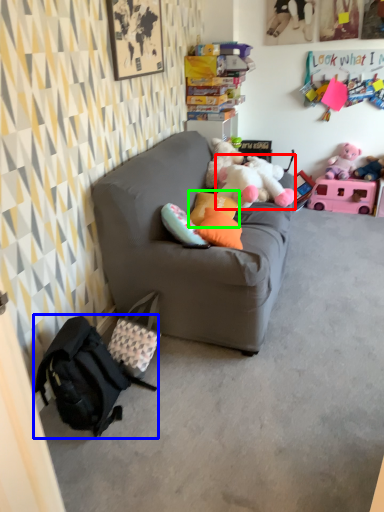
Question: Based on their relative distances, which object is farther from toy (highlighted by a red box)? Choose from backpack (highlighted by a blue box) and pillow (highlighted by a green box).

Choices:
 (A) backpack
 (B) pillow

Answer: (A)